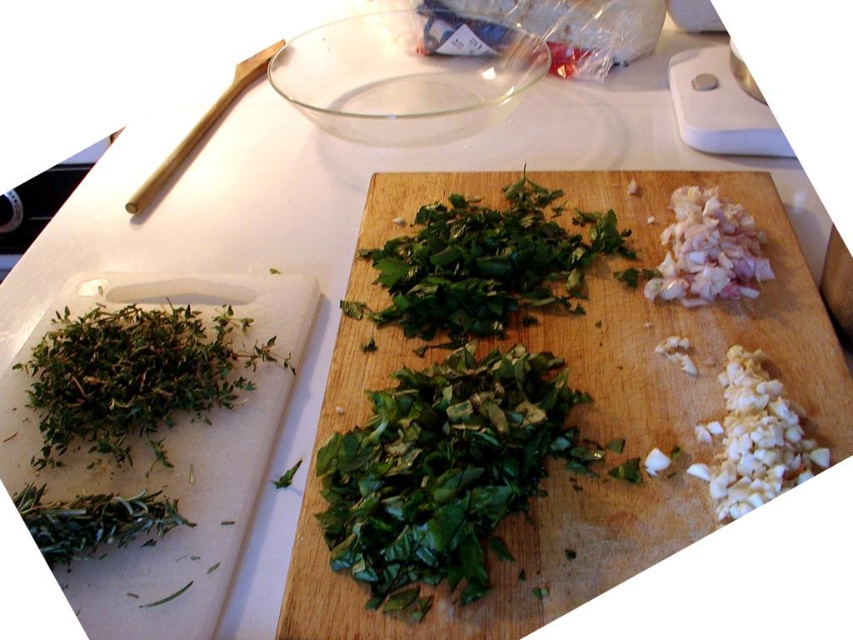
Does green leafy herb at left have a larger size compared to white diced garlic at upper right?

Correct, green leafy herb at left is larger in size than white diced garlic at upper right.

Is point (265, 342) in front of point (695, 218)?

Yes, it is in front of point (695, 218).

Describe the element at coordinates (135, 378) in the screenshot. I see `green leafy herb at left` at that location.

Where is `green leafy herb at left`? The height and width of the screenshot is (640, 853). green leafy herb at left is located at coordinates (135, 378).

Does green leafy herbs at center have a greater height compared to green leafy herb at left?

Yes.

Can you confirm if green leafy herbs at center is positioned to the left of green leafy herb at left?

In fact, green leafy herbs at center is to the right of green leafy herb at left.

Is point (593, 326) positioned behind point (206, 365)?

That is True.

The width and height of the screenshot is (853, 640). I want to click on green leafy herbs at center, so click(688, 324).

Does point (590, 273) come in front of point (706, 208)?

Yes, it is.

Which is below, green leafy herbs at center or white diced garlic at upper right?

green leafy herbs at center is below.

Is point (834, 349) behind point (718, 252)?

No, (834, 349) is closer to viewer.

Locate an element on the screen. green leafy herbs at center is located at coordinates (688, 324).